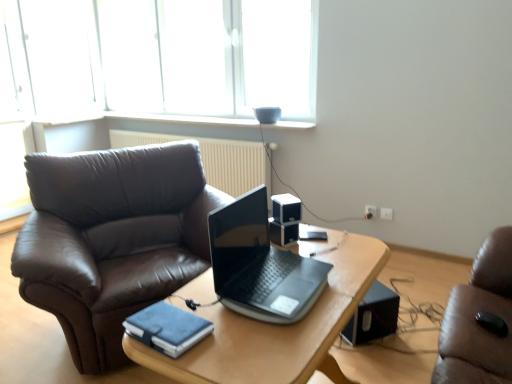
Question: Considering the relative sizes of black plastic speaker at center, the second loudspeaker when ordered from top to bottom, and black plastic speaker at lower right, which appears as the 1th loudspeaker when viewed from the right, in the image provided, is black plastic speaker at center, the second loudspeaker when ordered from top to bottom, bigger than black plastic speaker at lower right, which appears as the 1th loudspeaker when viewed from the right,?

Choices:
 (A) no
 (B) yes

Answer: (A)

Question: Is black plastic speaker at lower right, placed as the 3th loudspeaker when sorted from top to bottom, a part of black plastic speaker at center, the second loudspeaker when ordered from top to bottom?

Choices:
 (A) yes
 (B) no

Answer: (B)

Question: From a real-world perspective, is black plastic speaker at center, the 2th loudspeaker positioned from the back, below black plastic speaker at lower right, the 1th loudspeaker from the bottom?

Choices:
 (A) no
 (B) yes

Answer: (A)

Question: From the image's perspective, does black plastic speaker at center, acting as the 2th loudspeaker starting from the right, appear lower than black plastic speaker at lower right, placed as the 3th loudspeaker when sorted from top to bottom?

Choices:
 (A) no
 (B) yes

Answer: (A)

Question: Are black plastic speaker at center, positioned as the 2th loudspeaker in bottom-to-top order, and black plastic speaker at lower right, the 1th loudspeaker viewed from the back, beside each other?

Choices:
 (A) yes
 (B) no

Answer: (B)

Question: Looking at their shapes, would you say white plastic power outlet at lower right, the 1th power outlet from the right, is wider or thinner than white plastic power outlet at right, arranged as the second power outlet when viewed from the right?

Choices:
 (A) thin
 (B) wide

Answer: (A)

Question: Would you say white plastic power outlet at lower right, placed as the 2th power outlet when sorted from left to right, is inside or outside white plastic power outlet at right, placed as the 1th power outlet when sorted from left to right?

Choices:
 (A) inside
 (B) outside

Answer: (B)

Question: Is white plastic power outlet at lower right, the 1th power outlet from the right, bigger or smaller than white plastic power outlet at right, placed as the 1th power outlet when sorted from left to right?

Choices:
 (A) small
 (B) big

Answer: (A)

Question: Considering the positions of white plastic power outlet at lower right, placed as the 2th power outlet when sorted from left to right, and white plastic power outlet at right, placed as the 1th power outlet when sorted from left to right, in the image, is white plastic power outlet at lower right, placed as the 2th power outlet when sorted from left to right, taller or shorter than white plastic power outlet at right, placed as the 1th power outlet when sorted from left to right,?

Choices:
 (A) tall
 (B) short

Answer: (B)

Question: Is white plastic power outlet at right, arranged as the second power outlet when viewed from the right, wider or thinner than white plastic speaker at center, the first loudspeaker in the left-to-right sequence?

Choices:
 (A) wide
 (B) thin

Answer: (B)

Question: Based on their positions, is white plastic power outlet at right, placed as the 1th power outlet when sorted from left to right, located to the left or right of white plastic speaker at center, the first loudspeaker in the left-to-right sequence?

Choices:
 (A) right
 (B) left

Answer: (A)

Question: In terms of size, does white plastic power outlet at right, placed as the 1th power outlet when sorted from left to right, appear bigger or smaller than white plastic speaker at center, marked as the 3th loudspeaker in a back-to-front arrangement?

Choices:
 (A) big
 (B) small

Answer: (B)

Question: From the image's perspective, is white plastic power outlet at right, arranged as the second power outlet when viewed from the right, above or below white plastic speaker at center, acting as the 1th loudspeaker starting from the front?

Choices:
 (A) above
 (B) below

Answer: (B)

Question: Is wooden table at center wider or thinner than transparent glass window at upper center?

Choices:
 (A) wide
 (B) thin

Answer: (A)

Question: In terms of height, does wooden table at center look taller or shorter compared to transparent glass window at upper center?

Choices:
 (A) tall
 (B) short

Answer: (B)